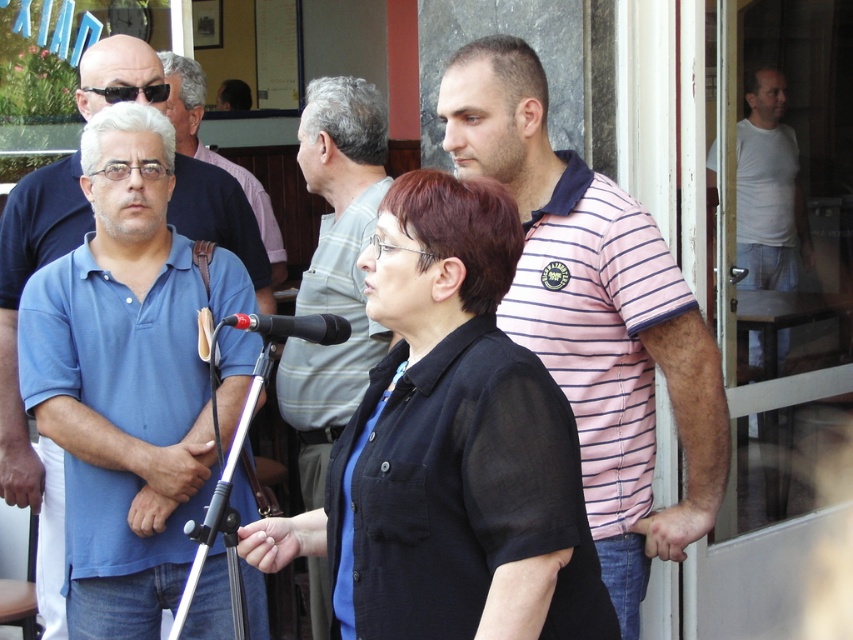
Question: Does black cotton shirt at center come in front of pink striped polo shirt at right?

Choices:
 (A) no
 (B) yes

Answer: (B)

Question: Which point is closer to the camera?

Choices:
 (A) black plastic microphone at center
 (B) blue shirt at left
 (C) pink striped polo shirt at center

Answer: (A)

Question: Among these points, which one is nearest to the camera?

Choices:
 (A) (323, 461)
 (B) (805, 252)
 (C) (177, 106)
 (D) (608, 330)

Answer: (D)

Question: Does pink striped polo shirt at right appear on the right side of gray striped shirt at center?

Choices:
 (A) yes
 (B) no

Answer: (A)

Question: Among these objects, which one is nearest to the camera?

Choices:
 (A) white cotton shirt at right
 (B) black plastic microphone at center
 (C) blue cotton polo shirt at left

Answer: (B)

Question: Does black cotton shirt at center appear on the left side of white cotton shirt at right?

Choices:
 (A) yes
 (B) no

Answer: (A)